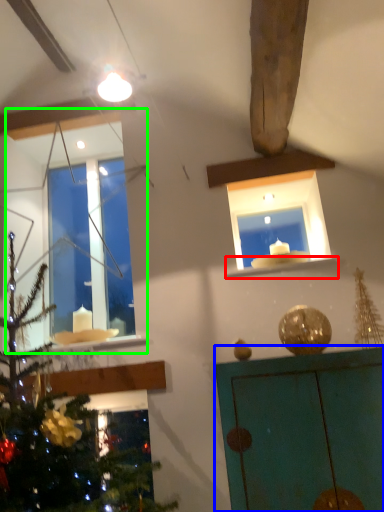
Question: Which object is the farthest from window sill (highlighted by a red box)? Choose among these: furniture (highlighted by a blue box) or window (highlighted by a green box).

Choices:
 (A) furniture
 (B) window

Answer: (B)